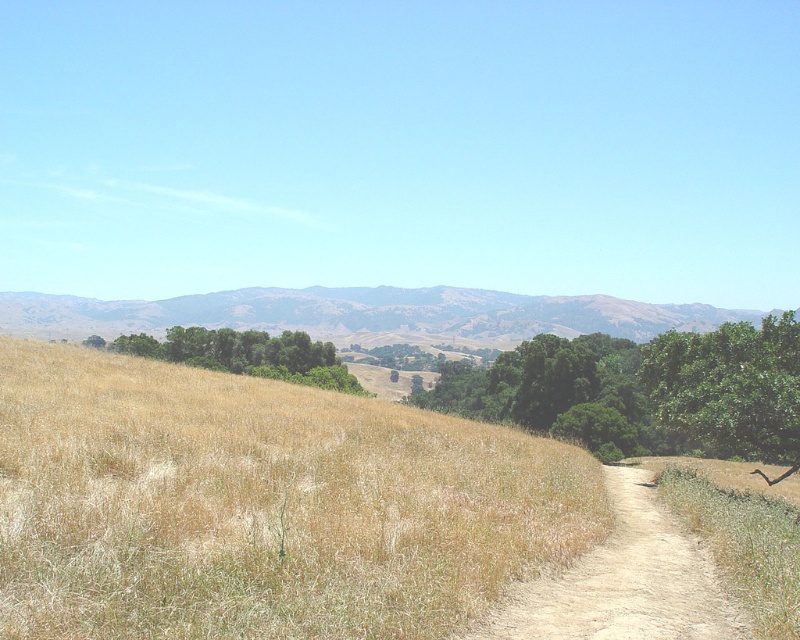
You are a hiker standing on the dry grass at center. You want to reach the green leafy trees at center. Given that your average walking speed is 1.5 meters per second, how many seconds will it take you to walk directly to the trees?

The distance between the dry grass at center and the green leafy trees at center is 49.90 meters. At a walking speed of 1.5 meters per second, dividing the distance by the speed gives approximately 33.27 seconds. Therefore, it will take roughly 33 seconds to reach the trees.

You are a hiker trying to navigate through the dusty sand path at center. There is a green leafy tree at right nearby. Can you estimate whether the path is narrower than the tree?

The dusty sand path at center is smaller than green leafy tree at right, so yes, the path is narrower than the tree.